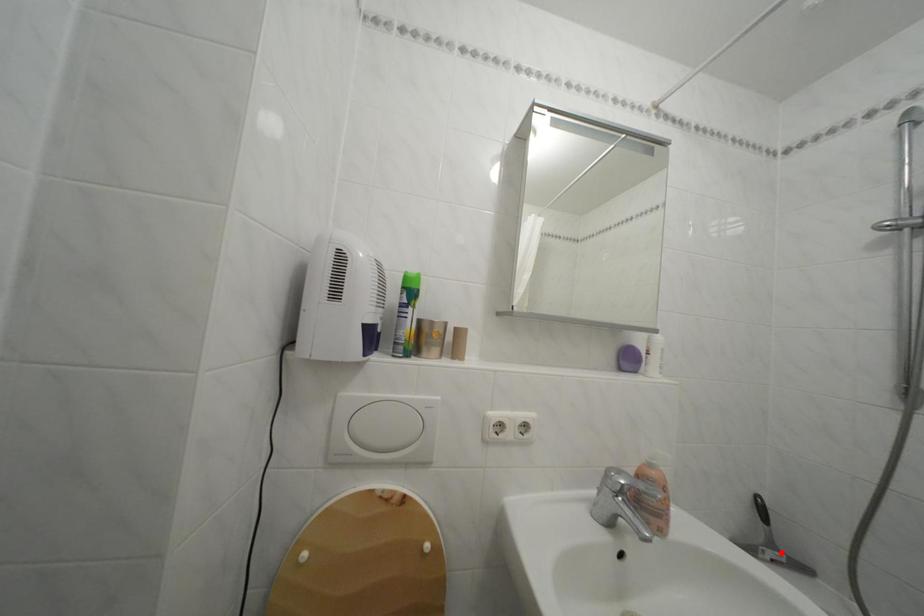
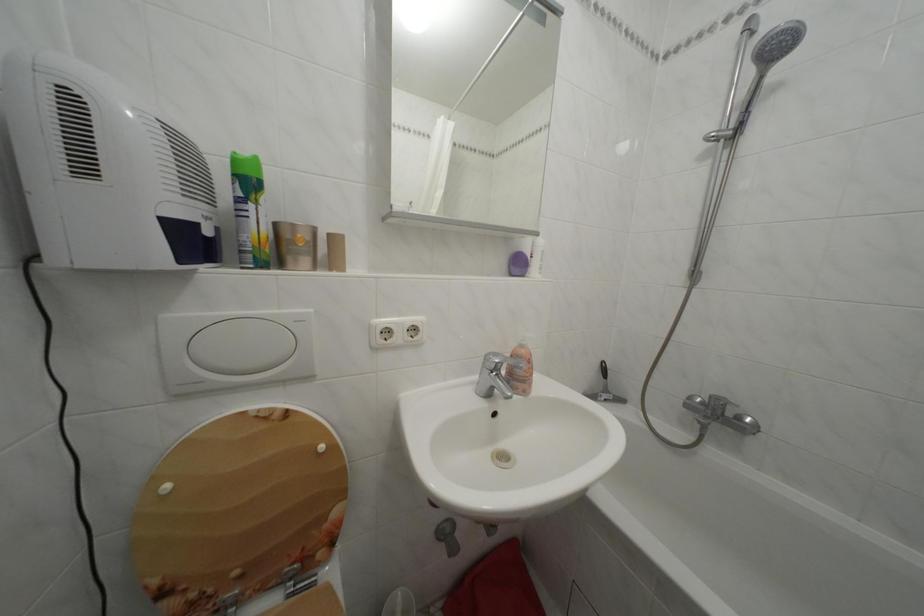
Question: I am providing you with two images of the same scene from different viewpoints. Given a red point in image1, look at the same physical point in image2. Is it:

Choices:
 (A) Closer to the viewpoint
 (B) Farther from the viewpoint

Answer: (B)